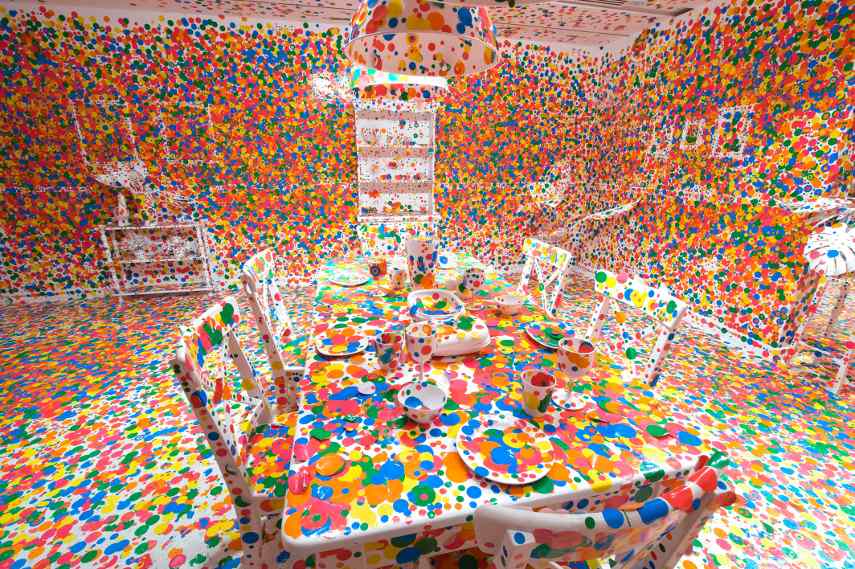
What are the coordinates of `chair` in the screenshot? It's located at (587, 519).